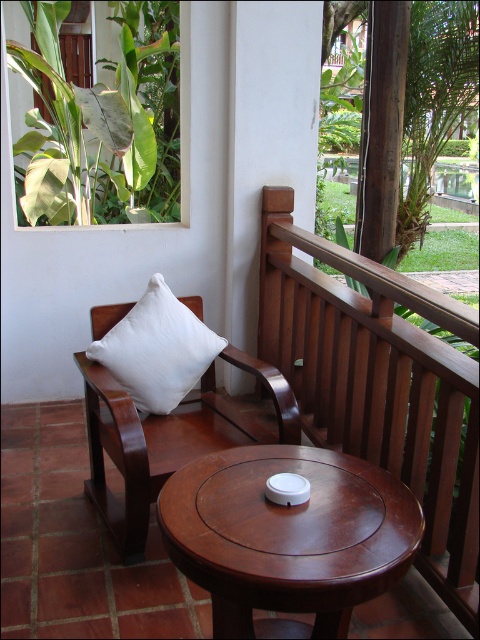
You are standing at the center of the balcony and want to move towards the brown wooden balustrade at upper right. What direction should you walk in?

Since the brown wooden balustrade at upper right is located at coordinates point (377, 384), you should walk towards the upper right direction to reach it.

You are standing on the balcony and want to place a potted plant on the mahogany wood round table at center. The potted plant has a diameter of 30 cm. Can you determine if the table will fit the plant?

The mahogany wood round table at center has a diameter of 30 cm, so the potted plant with a diameter of 30 cm will fit perfectly on the table.

Based on the photo, you are a delivery person who needs to place a rectangular package that is 1 meter wide on the balcony. The package must be placed either against the brown wooden balustrade at upper right or on the white cotton cushion at left. Based on their widths, which location can accommodate the package?

The brown wooden balustrade at upper right has a larger width than the white cotton cushion at left. Since the package is 1 meter wide, it would require a surface with sufficient width to support it. The brown wooden balustrade at upper right, being wider, can accommodate the package, while the white cotton cushion at left may not have enough space due to its narrower width.